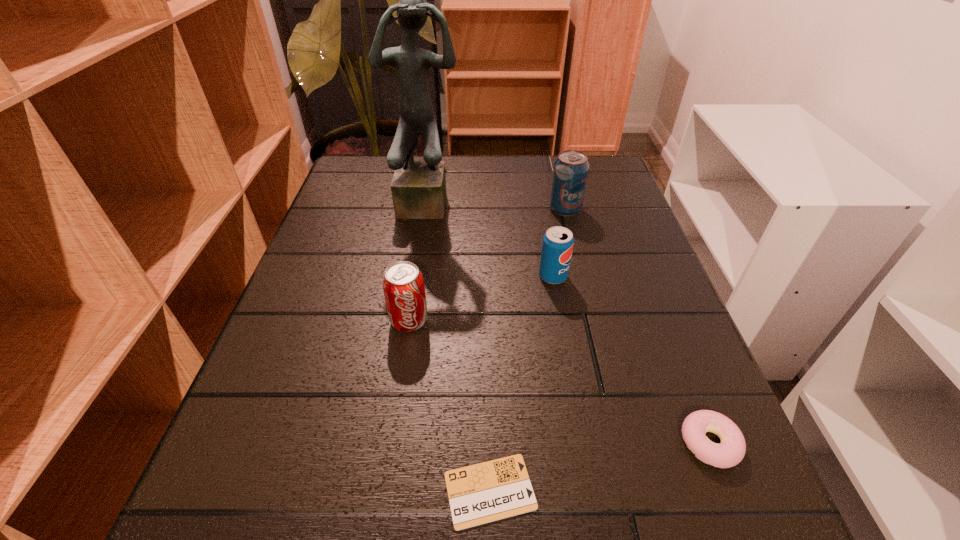
The height and width of the screenshot is (540, 960). I want to click on vacant space located 0.130m on the front of the leftmost soda can, so click(x=396, y=402).

Identify the location of vacant space located on the front of the second nearest soda can. The height and width of the screenshot is (540, 960). (567, 359).

Locate an element on the screen. Image resolution: width=960 pixels, height=540 pixels. vacant region located on the left of the second shortest object is located at coordinates (560, 443).

You are a GUI agent. You are given a task and a screenshot of the screen. Output one action in this format:
    pyautogui.click(x=<x>, y=<y>)
    Task: Click on the vacant space positioned on the left of the shortest object
    Image resolution: width=960 pixels, height=540 pixels.
    Given the screenshot: What is the action you would take?
    pyautogui.click(x=305, y=491)

At what (x,y) coordinates should I click in order to perform the action: click on sculpture that is positioned at the far edge. Please return your answer as a coordinate pair (x, y). This screenshot has width=960, height=540. Looking at the image, I should click on (418, 188).

Locate an element on the screen. This screenshot has width=960, height=540. pop soda located in the far edge section of the desktop is located at coordinates (570, 173).

Locate an element on the screen. The width and height of the screenshot is (960, 540). object at the near edge is located at coordinates (497, 489).

In order to click on object that is positioned at the left edge in this screenshot , I will do [418, 188].

You are a GUI agent. You are given a task and a screenshot of the screen. Output one action in this format:
    pyautogui.click(x=<x>, y=<y>)
    Task: Click on the pop soda that is at the right edge
    Image resolution: width=960 pixels, height=540 pixels.
    Given the screenshot: What is the action you would take?
    pyautogui.click(x=570, y=173)

The height and width of the screenshot is (540, 960). Identify the location of doughnut present at the right edge. pos(731,450).